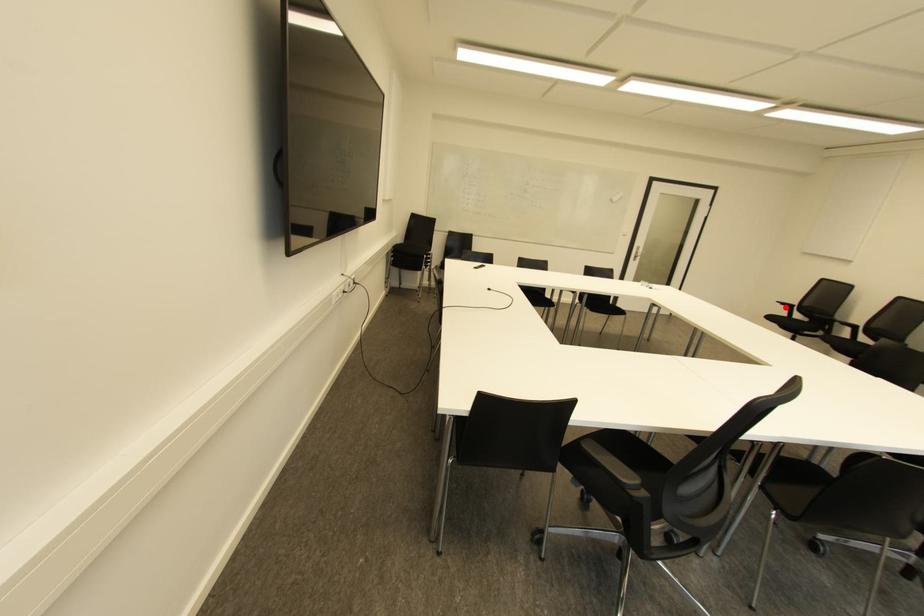
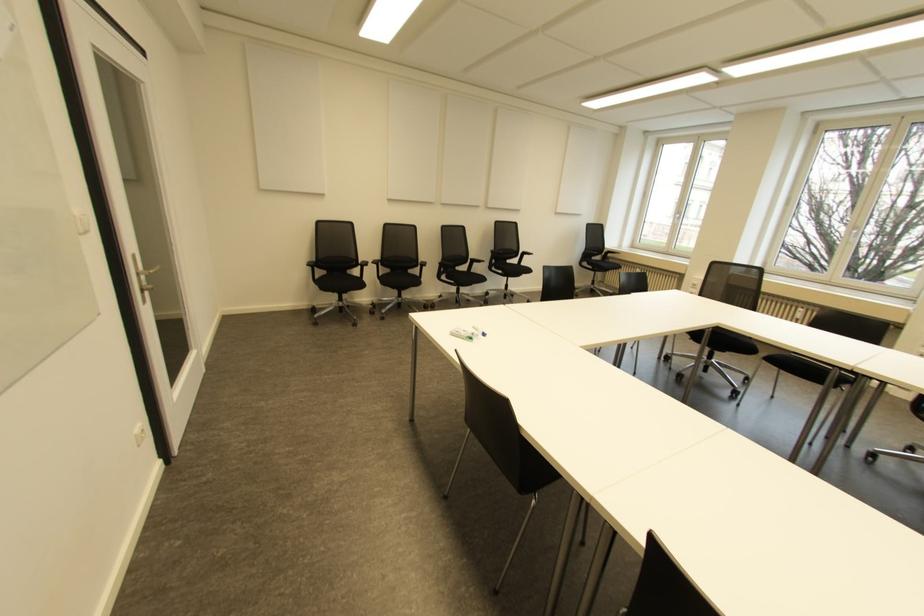
Question: I am providing you with two images of the same scene from different viewpoints. Image1 has a red point marked. In image2, the corresponding 3D location appears at what relative position? Reply with the corresponding letter.

Choices:
 (A) Closer
 (B) Farther

Answer: (A)